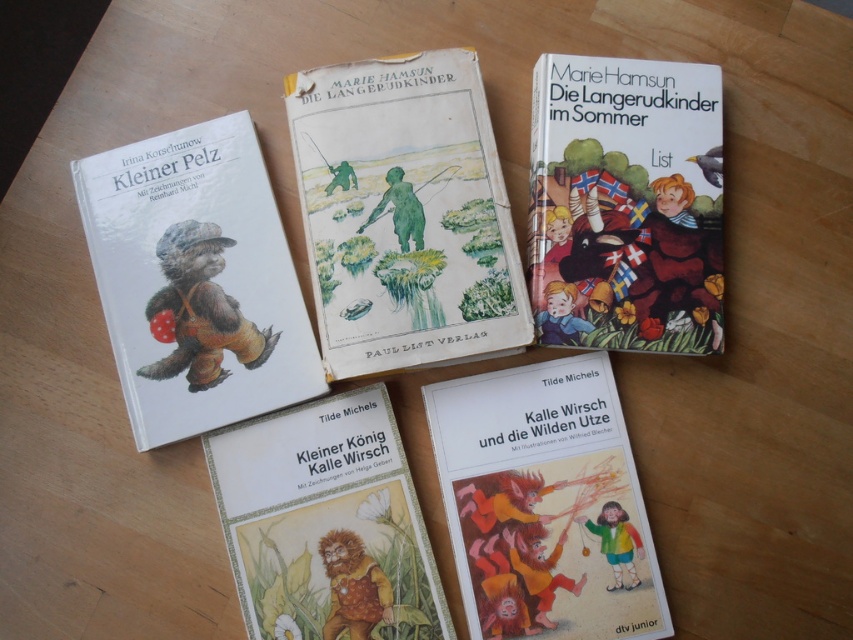
Question: Based on their relative distances, which object is farther from the matte brown bear at upper left?

Choices:
 (A) brown paper cover at center
 (B) watercolor paper illustration of children at center

Answer: (A)

Question: Which of the following is the farthest from the observer?

Choices:
 (A) (242, 228)
 (B) (703, 179)
 (C) (444, 120)

Answer: (C)

Question: Which object appears farthest from the camera in this image?

Choices:
 (A) matte brown bear at upper left
 (B) hardcover book at upper right
 (C) matte paper book at lower center

Answer: (B)

Question: Considering the relative positions of watercolor paper illustration of children at center and matte brown bear at upper left in the image provided, where is watercolor paper illustration of children at center located with respect to matte brown bear at upper left?

Choices:
 (A) above
 (B) below

Answer: (A)

Question: Is hardcover book at upper right to the right of brown paper cover at center from the viewer's perspective?

Choices:
 (A) yes
 (B) no

Answer: (A)

Question: Can you confirm if watercolor paper illustration of children at center is positioned below matte brown bear at upper left?

Choices:
 (A) no
 (B) yes

Answer: (A)